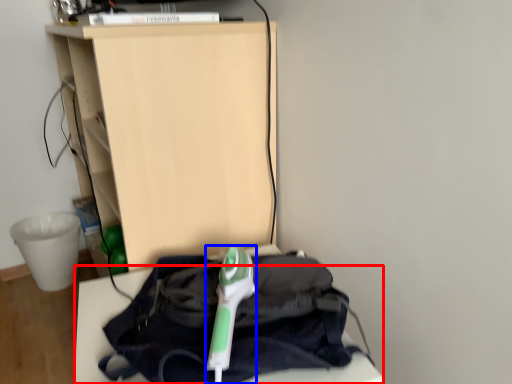
Question: Which object is further to the camera taking this photo, furniture (highlighted by a red box) or equipment (highlighted by a blue box)?

Choices:
 (A) furniture
 (B) equipment

Answer: (B)